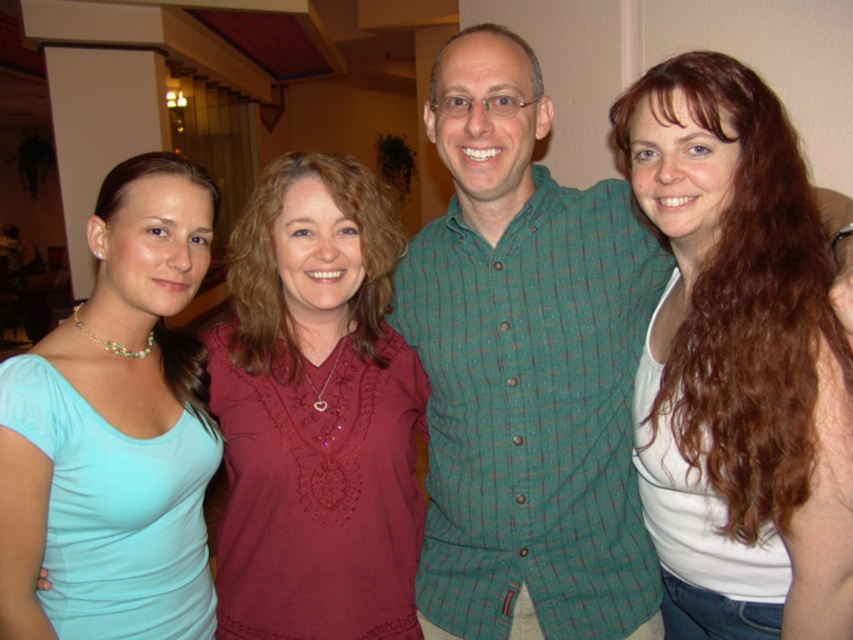
Based on the photo, you are at a social event and see two people wearing the green checkered shirt at center and the matte red blouse at center. Which one is positioned to the right of the other?

The green checkered shirt at center is to the right of the matte red blouse at center.

You are taking a photo of two points in the scene. The first point is at coordinate point(x=326, y=531) and the second is at point(x=183, y=273). Which point is closer to the camera?

Point(x=326, y=531) is closer to the camera than point(x=183, y=273).

You are at a social gathering and want to introduce yourself to the person wearing the green checkered shirt at center and the person wearing the matte red blouse at center. Which one is taller?

The green checkered shirt at center is taller than the matte red blouse at center.